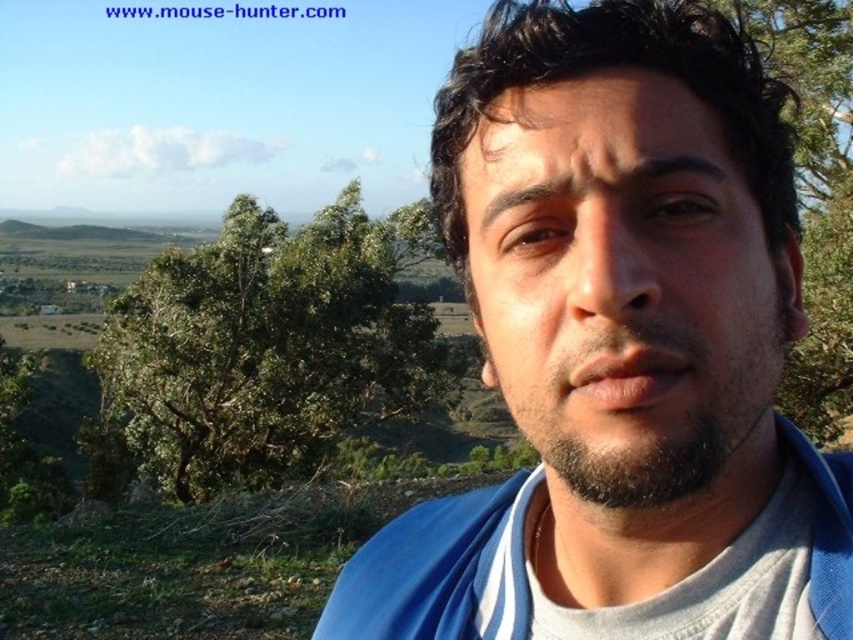
Which is in front, point (720, 336) or point (161, 436)?

Positioned in front is point (720, 336).

Who is positioned more to the left, blue fabric shirt at center or green leafy tree at upper left?

green leafy tree at upper left is more to the left.

Is point (460, 253) closer to camera compared to point (386, 236)?

Yes, point (460, 253) is closer to viewer.

Where is `blue fabric shirt at center`? This screenshot has width=853, height=640. blue fabric shirt at center is located at coordinates (619, 348).